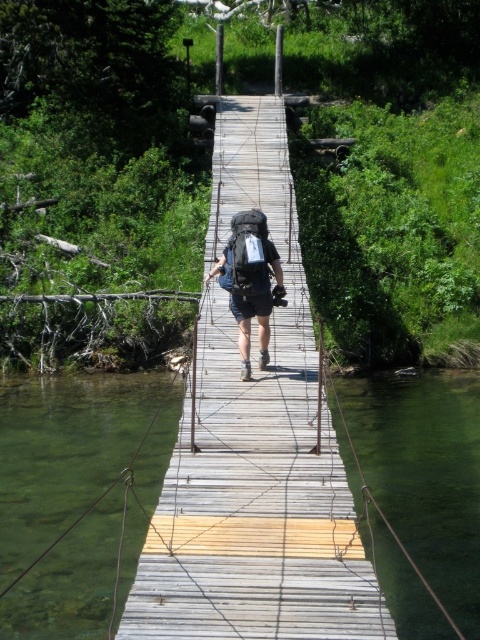
Looking at this image, is wooden bridge at center shorter than matte black backpack at center?

No, wooden bridge at center is not shorter than matte black backpack at center.

How far apart are wooden bridge at center and matte black backpack at center?

The distance of wooden bridge at center from matte black backpack at center is 7.60 feet.

Find the location of a particular element. This screenshot has width=480, height=640. wooden bridge at center is located at coordinates (253, 451).